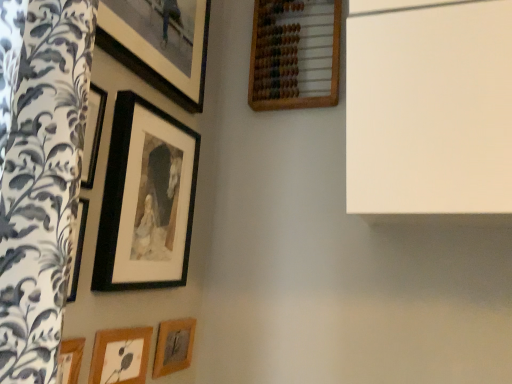
Question: Considering the positions of point (159, 332) and point (181, 99), is point (159, 332) closer or farther from the camera than point (181, 99)?

Choices:
 (A) farther
 (B) closer

Answer: (B)

Question: Is wooden picture frame at lower center, acting as the second picture frame starting from the right, in front of or behind matte black picture frame at upper left, the 3th picture frame positioned from the left, in the image?

Choices:
 (A) front
 (B) behind

Answer: (B)

Question: Which object is positioned closest to the wooden abacus at upper center, placed as the 5th picture frame when sorted from left to right?

Choices:
 (A) matte black picture frame at upper left, which is counted as the 3th picture frame, starting from the right
 (B) wooden picture frame at lower center, marked as the fourth picture frame in a left-to-right arrangement
 (C) wooden picture frame at lower left, the first picture frame viewed from the left
 (D) black matte picture frame at upper left, the fourth picture frame from the right

Answer: (A)

Question: Which object is positioned farthest from the wooden picture frame at lower center, marked as the fourth picture frame in a left-to-right arrangement?

Choices:
 (A) matte black picture frame at upper left, the 3th picture frame positioned from the left
 (B) wooden picture frame at lower left, the first picture frame viewed from the left
 (C) black matte picture frame at upper left, the fourth picture frame from the right
 (D) wooden abacus at upper center, placed as the 5th picture frame when sorted from left to right

Answer: (D)